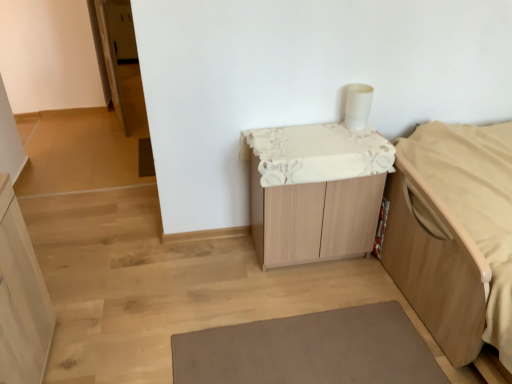
Identify the location of unoccupied space behind gray matte bath mat at lower center. This screenshot has height=384, width=512. (287, 285).